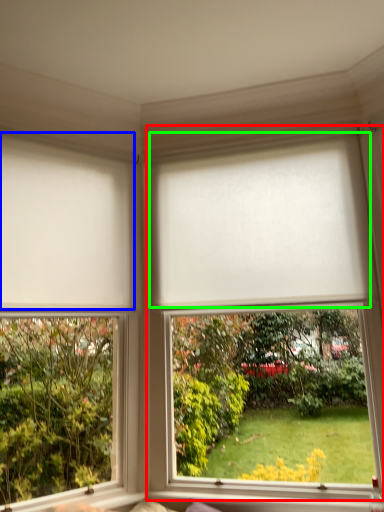
Question: Estimate the real-world distances between objects in this image. Which object is closer to window (highlighted by a red box), blind (highlighted by a blue box) or blind (highlighted by a green box)?

Choices:
 (A) blind
 (B) blind

Answer: (B)